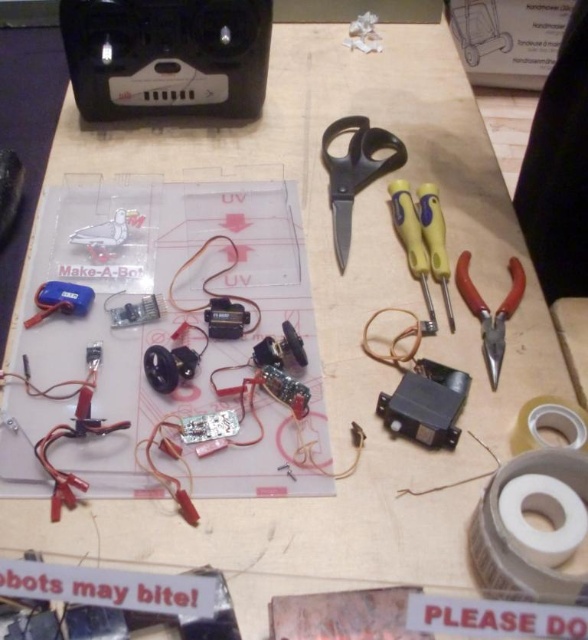
Question: Is black plastic scissors at center positioned in front of yellow plastic screwdriver at center-right?

Choices:
 (A) yes
 (B) no

Answer: (B)

Question: Which object is closer to the camera taking this photo?

Choices:
 (A) yellow plastic screwdriver at center-right
 (B) yellow plastic screwdriver at right
 (C) red plastic pliers at lower right

Answer: (C)

Question: Is black plastic scissors at center wider than yellow plastic screwdriver at center-right?

Choices:
 (A) no
 (B) yes

Answer: (B)

Question: Which point is farther to the camera?

Choices:
 (A) yellow plastic screwdriver at right
 (B) yellow plastic screwdriver at center-right
 (C) black plastic scissors at center

Answer: (C)

Question: Which is nearer to the yellow plastic screwdriver at right?

Choices:
 (A) red plastic pliers at lower right
 (B) yellow plastic screwdriver at center-right

Answer: (B)

Question: Is black plastic scissors at center positioned behind yellow plastic screwdriver at center-right?

Choices:
 (A) yes
 (B) no

Answer: (A)